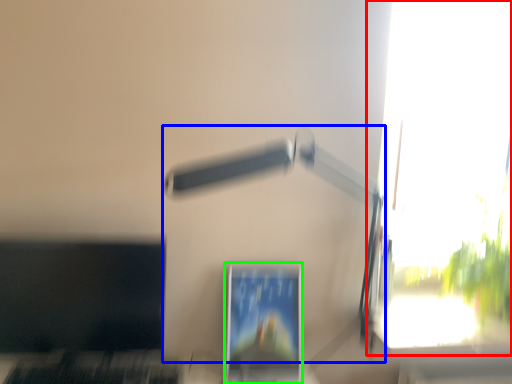
Question: Which object is the farthest from window (highlighted by a red box)? Choose among these: lamp (highlighted by a blue box) or computer monitor (highlighted by a green box).

Choices:
 (A) lamp
 (B) computer monitor

Answer: (B)